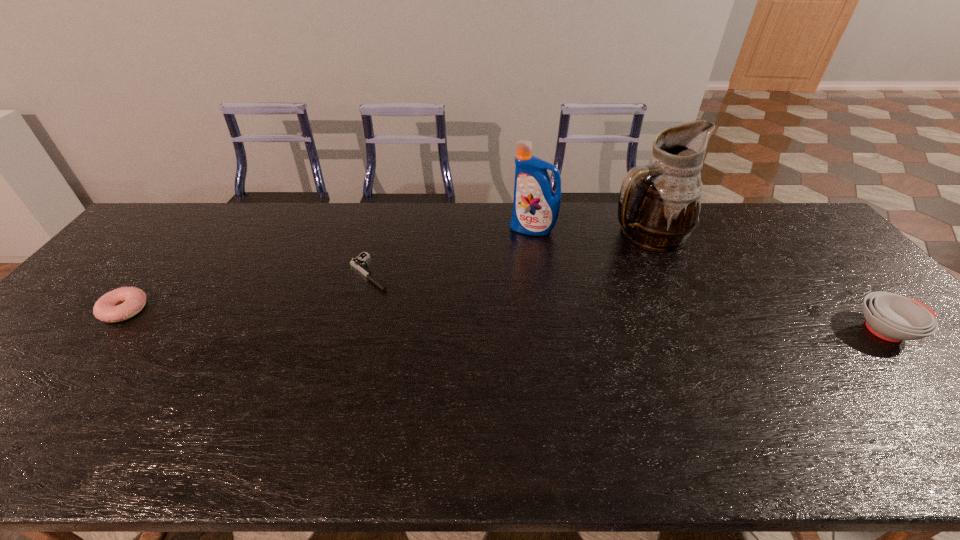
The image size is (960, 540). In order to click on vacant space at the far right corner of the desktop in this screenshot , I will do `click(805, 228)`.

The image size is (960, 540). Find the location of `vacant space that's between the rightmost object and the pistol`. vacant space that's between the rightmost object and the pistol is located at coordinates (628, 301).

At what (x,y) coordinates should I click in order to perform the action: click on free space between the detergent and the shortest object. Please return your answer as a coordinate pair (x, y). Looking at the image, I should click on (451, 251).

The width and height of the screenshot is (960, 540). Identify the location of unoccupied area between the rightmost object and the second tallest object. (709, 279).

Identify the location of unoccupied position between the leftmost object and the rightmost object. (506, 320).

This screenshot has height=540, width=960. Identify the location of blank region between the pistol and the doughnut. (247, 291).

Identify the location of empty space between the second object from left to right and the second shortest object. The height and width of the screenshot is (540, 960). (247, 291).

Where is `vacant area that lies between the fourth shortest object and the shortest object`? The height and width of the screenshot is (540, 960). vacant area that lies between the fourth shortest object and the shortest object is located at coordinates (451, 251).

Where is `free point between the shortest object and the rightmost object`? The image size is (960, 540). free point between the shortest object and the rightmost object is located at coordinates (628, 301).

Locate an element on the screen. The width and height of the screenshot is (960, 540). vacant area between the shortest object and the tallest object is located at coordinates (508, 253).